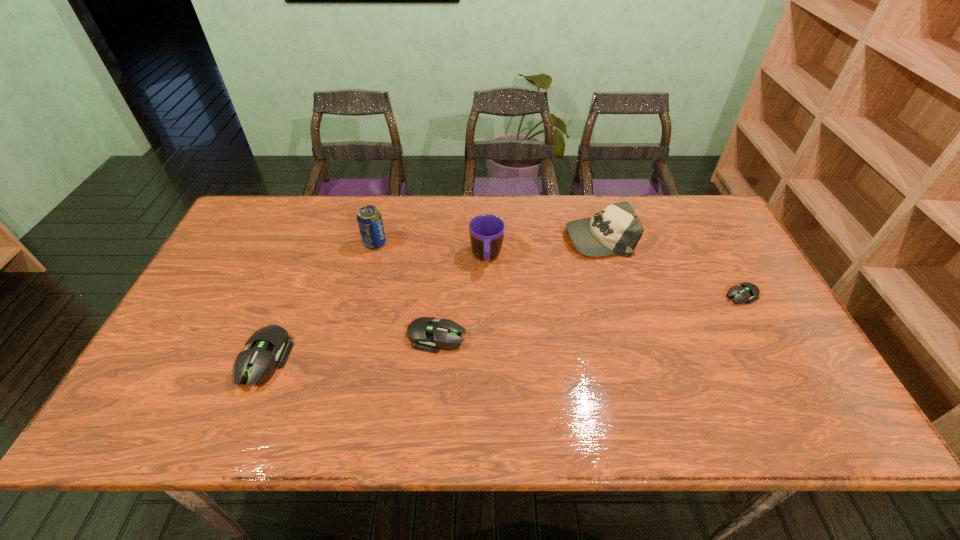
The height and width of the screenshot is (540, 960). Find the location of `vacant area that lies between the mug and the second shortest object`. vacant area that lies between the mug and the second shortest object is located at coordinates (462, 297).

The image size is (960, 540). Find the location of `empty space between the third object from right to left and the leftmost computer mouse`. empty space between the third object from right to left and the leftmost computer mouse is located at coordinates (375, 309).

You are a GUI agent. You are given a task and a screenshot of the screen. Output one action in this format:
    pyautogui.click(x=<x>, y=<y>)
    Task: Click on the free space between the fourth object from left to right and the second shortest computer mouse
    The image size is (960, 540).
    Given the screenshot: What is the action you would take?
    pyautogui.click(x=462, y=297)

Identify the location of empty space between the second object from left to right and the second computer mouse from left to right. (406, 289).

What are the coordinates of `free spot between the second object from left to right and the second tallest computer mouse` in the screenshot? It's located at (406, 289).

Where is `vacant space that is in between the leftmost object and the shortest object`? This screenshot has height=540, width=960. vacant space that is in between the leftmost object and the shortest object is located at coordinates (502, 327).

Identify the location of free space between the farthest computer mouse and the second shortest object. (588, 315).

Point out which object is positioned as the fourth nearest to the leftmost computer mouse. Please provide its 2D coordinates. Your answer should be formatted as a tuple, i.e. [(x, y)], where the tuple contains the x and y coordinates of a point satisfying the conditions above.

[(616, 230)]

Select which object appears as the fifth closest to the fourth shortest object. Please provide its 2D coordinates. Your answer should be formatted as a tuple, i.e. [(x, y)], where the tuple contains the x and y coordinates of a point satisfying the conditions above.

[(255, 366)]

In order to click on computer mouse that can be found as the second closest to the second object from left to right in this screenshot , I will do `click(255, 366)`.